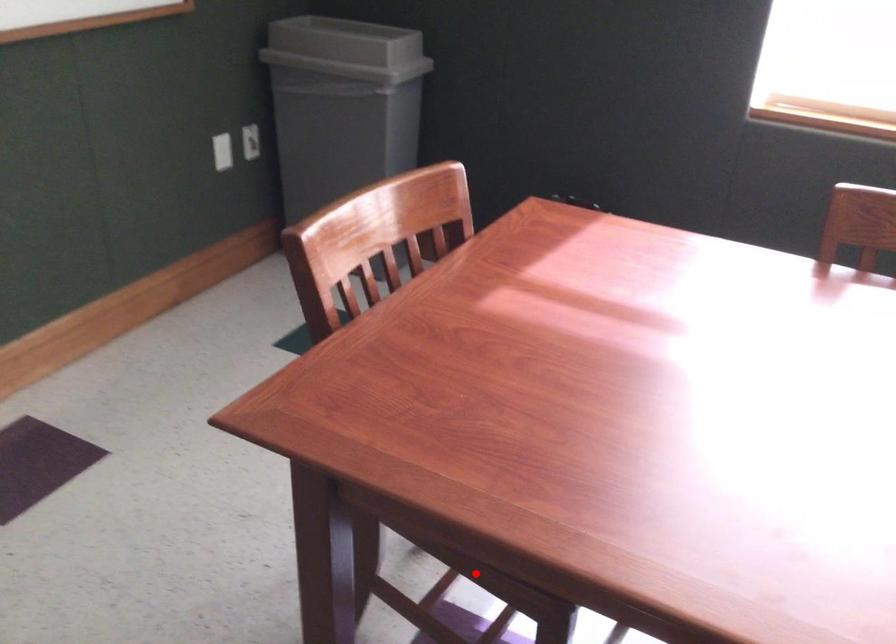
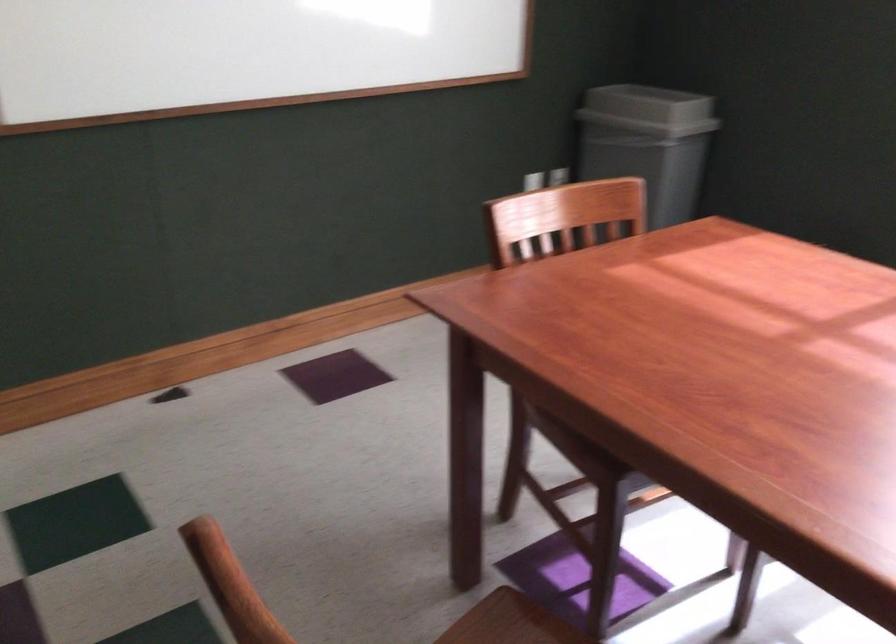
Where in the second image is the point corresponding to the highlighted location from the first image?

(570, 453)